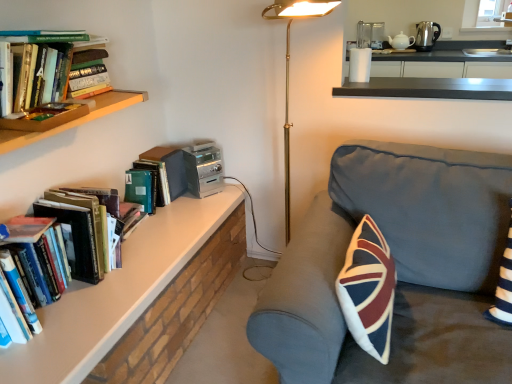
Where is `free space in front of silver metallic stereo at upper center, marked as the 1th appliance in a bottom-to-top arrangement`? This screenshot has height=384, width=512. free space in front of silver metallic stereo at upper center, marked as the 1th appliance in a bottom-to-top arrangement is located at coordinates (198, 207).